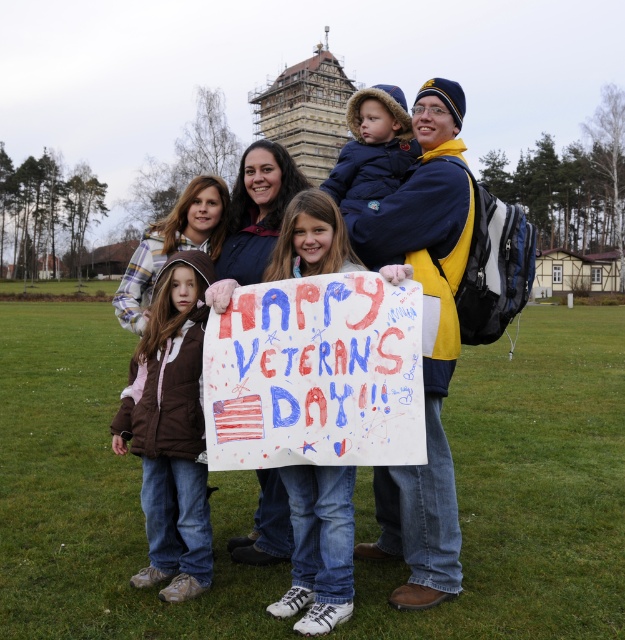
Can you confirm if brown fleece jacket at lower left is taller than dark blue fleece jacket at center?

In fact, brown fleece jacket at lower left may be shorter than dark blue fleece jacket at center.

The width and height of the screenshot is (625, 640). Identify the location of brown fleece jacket at lower left. (171, 429).

The height and width of the screenshot is (640, 625). I want to click on brown fleece jacket at lower left, so click(x=171, y=429).

In the scene shown: Can you confirm if hand-drawn paper sign at center is positioned to the left of dark blue fleece jacket at center?

Correct, you'll find hand-drawn paper sign at center to the left of dark blue fleece jacket at center.

Does hand-drawn paper sign at center appear under dark blue fleece jacket at center?

Correct, hand-drawn paper sign at center is located below dark blue fleece jacket at center.

Is point (248, 445) less distant than point (358, 132)?

That is True.

Locate an element on the screen. The width and height of the screenshot is (625, 640). hand-drawn paper sign at center is located at coordinates (316, 372).

Is matte white sign at center thinner than brown fleece jacket at lower left?

In fact, matte white sign at center might be wider than brown fleece jacket at lower left.

Which is above, matte white sign at center or brown fleece jacket at lower left?

Positioned higher is matte white sign at center.

You are a GUI agent. You are given a task and a screenshot of the screen. Output one action in this format:
    pyautogui.click(x=<x>, y=<y>)
    Task: Click on the matte white sign at center
    The image size is (625, 640).
    Given the screenshot: What is the action you would take?
    pyautogui.click(x=440, y=324)